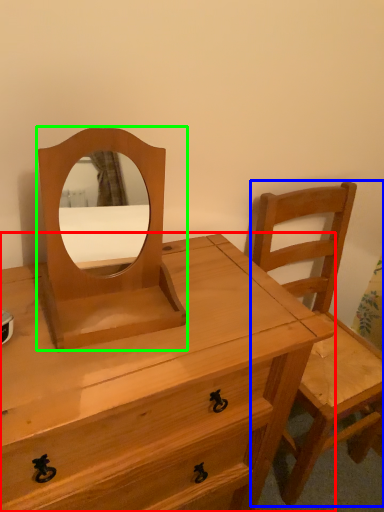
Question: Which is nearer to the chest of drawers (highlighted by a red box)? chair (highlighted by a blue box) or mirror (highlighted by a green box).

Choices:
 (A) chair
 (B) mirror

Answer: (B)